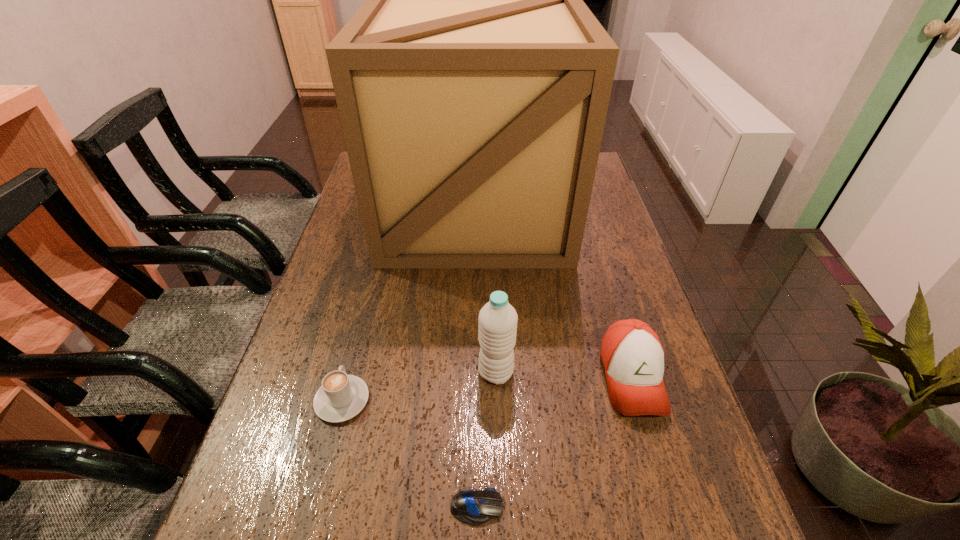
At what (x,y) coordinates should I click in order to perform the action: click on free space located 0.090m to the right of the fourth tallest object. Please return your answer as a coordinate pair (x, y). Looking at the image, I should click on (356, 344).

Identify the location of vacant area located to the right of the fourth tallest object. (372, 281).

Identify the location of free spot located 0.370m to the right of the fourth tallest object. The image size is (960, 540). (377, 264).

Where is `free space located 0.370m on the button side of the shortest object`? The width and height of the screenshot is (960, 540). free space located 0.370m on the button side of the shortest object is located at coordinates 719,507.

The width and height of the screenshot is (960, 540). Find the location of `object present at the far edge`. object present at the far edge is located at coordinates (473, 84).

Where is `box that is positioned at the left edge`? box that is positioned at the left edge is located at coordinates (473, 84).

Find the location of a particular element. cappuccino that is at the left edge is located at coordinates (340, 397).

The image size is (960, 540). I want to click on box at the right edge, so click(x=473, y=84).

Identify the location of baseball cap present at the right edge. This screenshot has width=960, height=540. (632, 356).

Locate an element on the screen. Image resolution: width=960 pixels, height=540 pixels. object positioned at the far left corner is located at coordinates (473, 84).